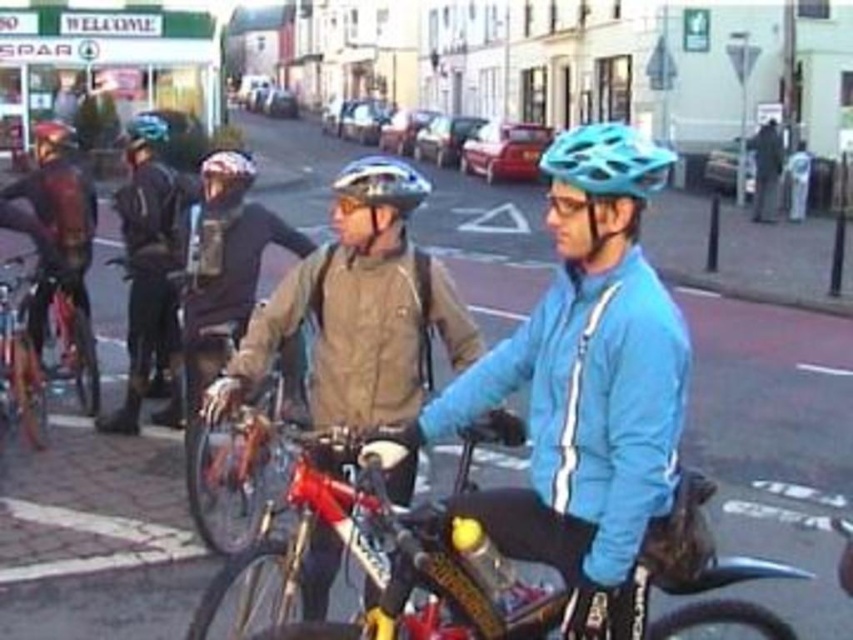
Question: Does matte black jacket at center have a greater width compared to matte black helmet at upper left?

Choices:
 (A) yes
 (B) no

Answer: (B)

Question: Is the position of matte blue jacket at center less distant than that of matte black helmet at center?

Choices:
 (A) yes
 (B) no

Answer: (A)

Question: From the image, what is the correct spatial relationship of matte blue jacket at center in relation to teal matte bicycle helmet at center?

Choices:
 (A) below
 (B) above

Answer: (A)

Question: Which of the following is the closest to the observer?

Choices:
 (A) matte silver helmet at center
 (B) teal matte bicycle helmet at center

Answer: (B)

Question: Among these points, which one is nearest to the camera?

Choices:
 (A) (535, 621)
 (B) (639, 422)
 (C) (361, 198)
 (D) (669, 166)

Answer: (B)

Question: Which of the following is the farthest from the observer?

Choices:
 (A) matte black jacket at center
 (B) matte black helmet at center
 (C) shiny metallic bicycle at left

Answer: (A)